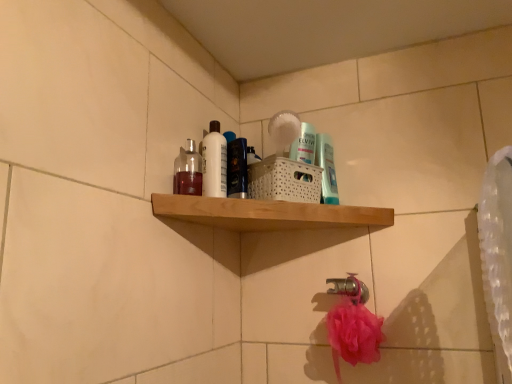
Question: Does shiny blue bottle at center have a lesser width compared to white glossy bottle at upper center?

Choices:
 (A) no
 (B) yes

Answer: (A)

Question: Is the position of shiny blue bottle at center less distant than that of white glossy bottle at upper center?

Choices:
 (A) no
 (B) yes

Answer: (B)

Question: Is shiny blue bottle at center taller than white glossy bottle at upper center?

Choices:
 (A) no
 (B) yes

Answer: (A)

Question: Considering the relative sizes of shiny blue bottle at center and white glossy bottle at upper center in the image provided, is shiny blue bottle at center wider than white glossy bottle at upper center?

Choices:
 (A) yes
 (B) no

Answer: (A)

Question: From a real-world perspective, is shiny blue bottle at center physically above white glossy bottle at upper center?

Choices:
 (A) yes
 (B) no

Answer: (B)

Question: In terms of height, does translucent glass bottle at upper left, the second mouthwash in the right-to-left sequence, look taller or shorter compared to white glossy bottle at upper center?

Choices:
 (A) tall
 (B) short

Answer: (B)

Question: From the image's perspective, is translucent glass bottle at upper left, the second mouthwash in the right-to-left sequence, located above or below white glossy bottle at upper center?

Choices:
 (A) below
 (B) above

Answer: (A)

Question: From a real-world perspective, is translucent glass bottle at upper left, the 1th mouthwash positioned from the left, positioned above or below white glossy bottle at upper center?

Choices:
 (A) below
 (B) above

Answer: (A)

Question: In the image, is translucent glass bottle at upper left, the 1th mouthwash positioned from the left, positioned in front of or behind white glossy bottle at upper center?

Choices:
 (A) front
 (B) behind

Answer: (A)

Question: From a real-world perspective, is shiny blue bottle at center above or below white glossy bottle at upper center?

Choices:
 (A) above
 (B) below

Answer: (B)

Question: From the image's perspective, relative to white glossy bottle at upper center, is shiny blue bottle at center above or below?

Choices:
 (A) below
 (B) above

Answer: (A)

Question: In terms of width, does shiny blue bottle at center look wider or thinner when compared to white glossy bottle at upper center?

Choices:
 (A) wide
 (B) thin

Answer: (A)

Question: In terms of size, does shiny blue bottle at center appear bigger or smaller than white glossy bottle at upper center?

Choices:
 (A) big
 (B) small

Answer: (A)

Question: Does point (218, 162) appear closer or farther from the camera than point (339, 286)?

Choices:
 (A) closer
 (B) farther

Answer: (A)

Question: In the image, is white glossy bottle at upper center on the left side or the right side of silver metallic faucet at lower center?

Choices:
 (A) left
 (B) right

Answer: (A)